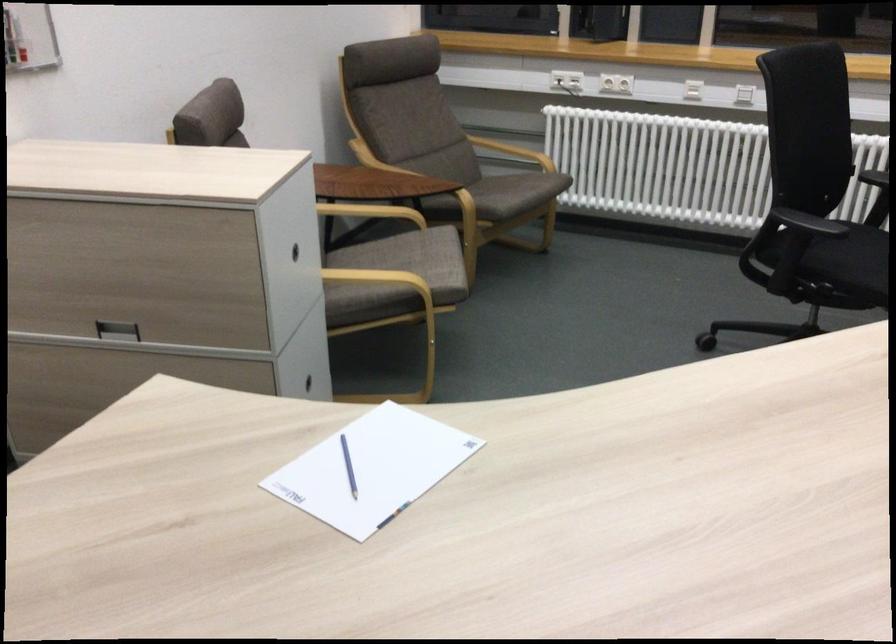
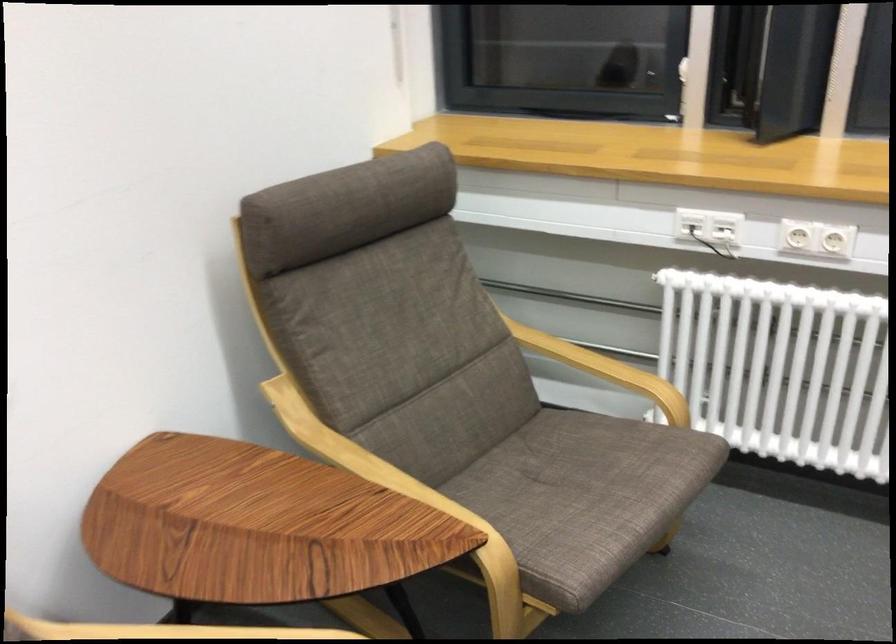
Question: In a continuous first-person perspective shot, in which direction is the camera moving?

Choices:
 (A) Left
 (B) Right
 (C) Forward
 (D) Backward

Answer: (C)